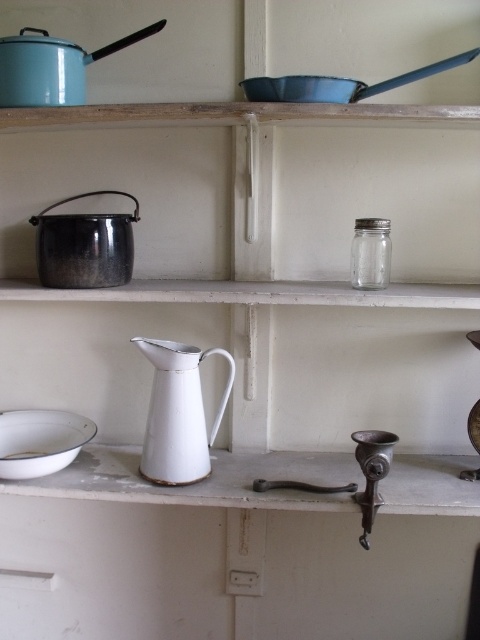
Does enamel blue pot at upper left have a greater width compared to white enamel plate at lower left?

Indeed, enamel blue pot at upper left has a greater width compared to white enamel plate at lower left.

Find the location of a particular element. enamel blue pot at upper left is located at coordinates (51, 67).

Is white enameled pitcher at center shorter than white enamel plate at lower left?

In fact, white enameled pitcher at center may be taller than white enamel plate at lower left.

Who is more forward, (155, 454) or (22, 460)?

Point (22, 460) is more forward.

Measure the distance between point (200, 355) and camera.

4.08 feet

At what (x,y) coordinates should I click in order to perform the action: click on white enameled pitcher at center. Please return your answer as a coordinate pair (x, y). This screenshot has height=640, width=480. Looking at the image, I should click on (178, 412).

Is white enameled pitcher at center taller than enamel blue pot at upper left?

Yes.

Is white enameled pitcher at center wider than enamel blue pot at upper left?

No, white enameled pitcher at center is not wider than enamel blue pot at upper left.

Which is in front, point (204, 465) or point (43, 35)?

Positioned in front is point (204, 465).

Where is `white enameled pitcher at center`? Image resolution: width=480 pixels, height=640 pixels. white enameled pitcher at center is located at coordinates (178, 412).